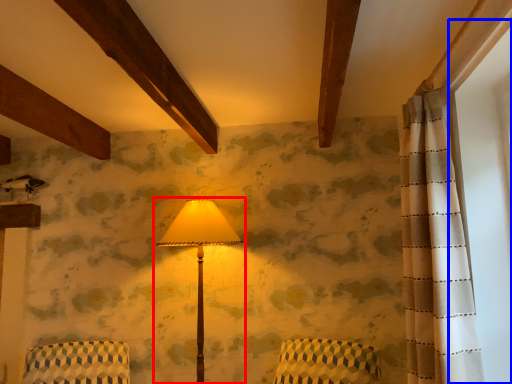
Question: Which point is closer to the camera, lamp (highlighted by a red box) or window screen (highlighted by a blue box)?

Choices:
 (A) lamp
 (B) window screen

Answer: (B)